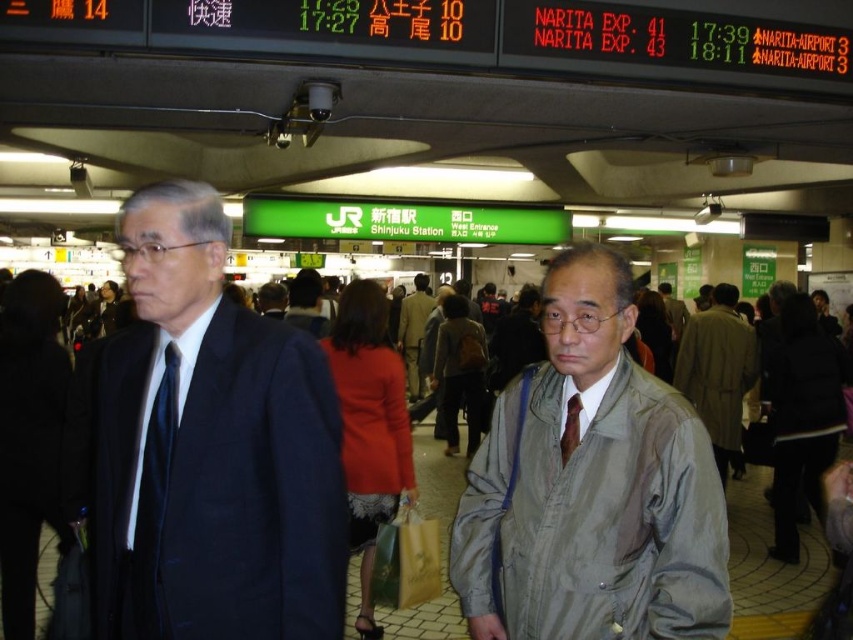
Question: Which point appears farthest from the camera in this image?

Choices:
 (A) (695, 371)
 (B) (416, 387)
 (C) (166, 262)

Answer: (B)

Question: Which point is closer to the camera?

Choices:
 (A) (717, 499)
 (B) (403, 307)
 (C) (138, 525)

Answer: (A)

Question: Does matte black suit at left appear over light brown fabric coat at center?

Choices:
 (A) yes
 (B) no

Answer: (A)

Question: Estimate the real-world distances between objects in this image. Which object is closer to the gray fabric jacket at center?

Choices:
 (A) light gray fabric coat at center
 (B) light brown fabric coat at center
 (C) matte black suit at left
 (D) brown silk tie at center

Answer: (D)

Question: Is light brown fabric coat at center to the left of brown silk tie at center from the viewer's perspective?

Choices:
 (A) no
 (B) yes

Answer: (B)

Question: In this image, where is matte black suit at left located relative to light brown fabric coat at center?

Choices:
 (A) above
 (B) below

Answer: (A)